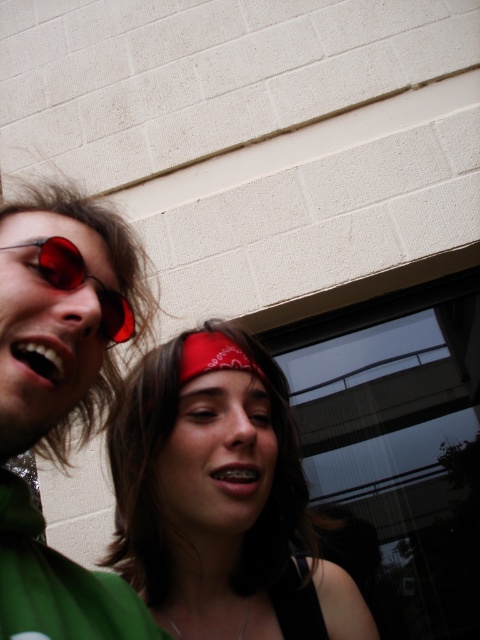
Question: Which object appears farthest from the camera in this image?

Choices:
 (A) matte red sunglasses at left
 (B) red bandana at center
 (C) matte red goggles at left

Answer: (B)

Question: Is matte red sunglasses at left closer to camera compared to matte red goggles at left?

Choices:
 (A) no
 (B) yes

Answer: (B)

Question: Which object is the closest to the matte red sunglasses at left?

Choices:
 (A) matte red goggles at left
 (B) red bandana at center

Answer: (A)

Question: Can you confirm if red bandana at center is positioned below matte red sunglasses at left?

Choices:
 (A) no
 (B) yes

Answer: (B)

Question: Can you confirm if red bandana at center is positioned to the left of matte red sunglasses at left?

Choices:
 (A) no
 (B) yes

Answer: (A)

Question: Which is farther from the red bandana at center?

Choices:
 (A) matte red goggles at left
 (B) matte red sunglasses at left

Answer: (A)